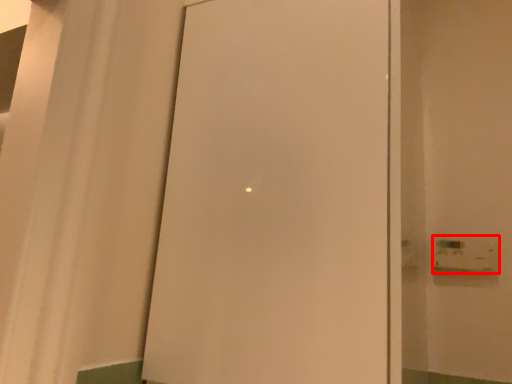
Question: From the image's perspective, what is the correct spatial relationship of light switch (annotated by the red box) in relation to door?

Choices:
 (A) above
 (B) below

Answer: (B)